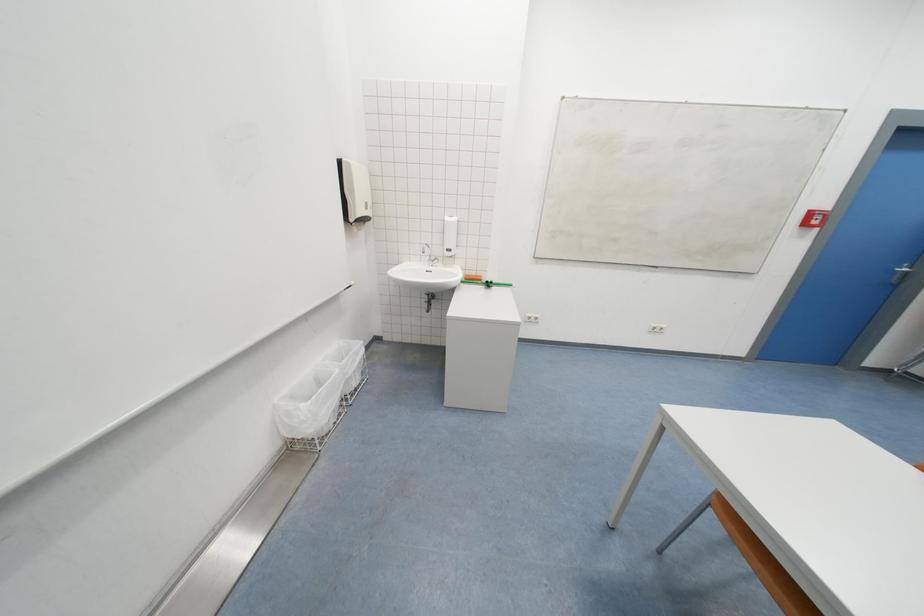
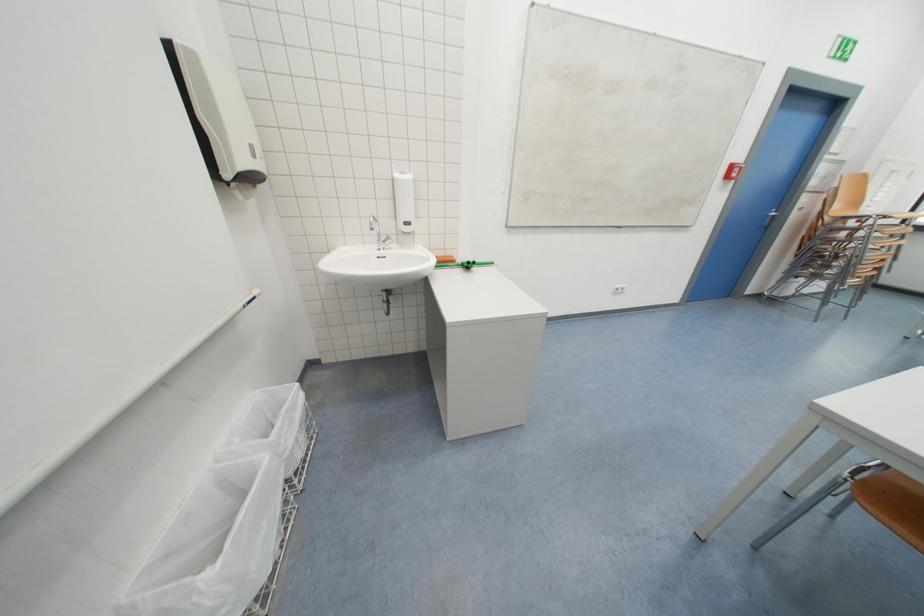
Which direction would the cameraman need to move to produce the second image?

The movement direction of the cameraman is left, forward.